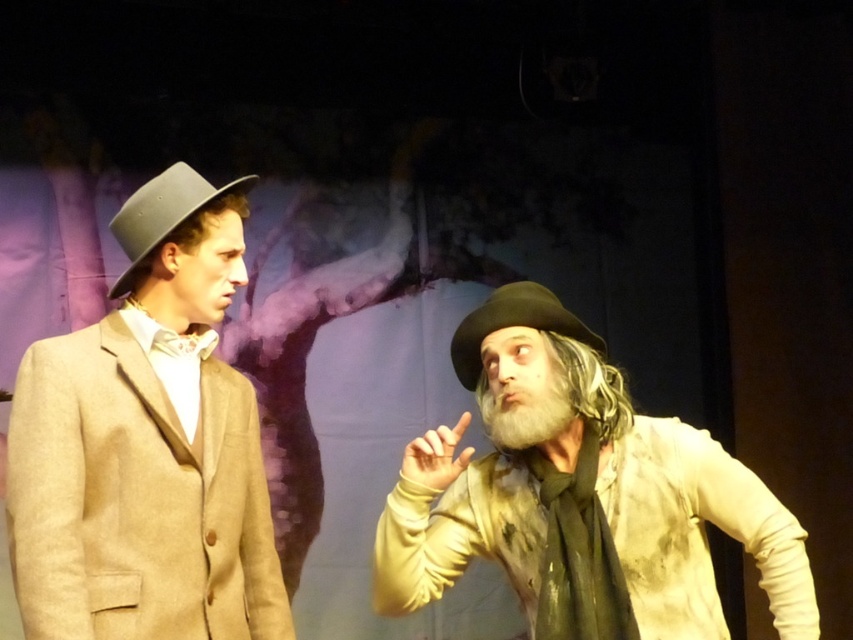
You are an assistant helping to stage a play. You need to ensure that the matte brown suit at left and the black felt dress hat at center are visible to the audience. Since the stage is narrow, you must determine which object is wider to position them appropriately. Which object has a greater width?

The matte brown suit at left has a greater width than the black felt dress hat at center according to the description.

You are directing a play and need to position two actors on stage. The first actor must stand at point [389,554] and the second at point [189,195]. From the audience perspective, which actor will appear closer to the front of the stage?

The actor at point [389,554] will appear closer to the front of the stage because point [389,554] is in front of point [189,195] according to the stage coordinates.

You are a costume designer preparing for a play. You need to ensure that the dirty beige shirt at right and the matte gray dress hat at left fit within the stage backdrop. Given that the backdrop has a maximum width allowance of 1.2 meters, can both items fit side by side without exceeding this limit?

The dirty beige shirt at right is wider than the matte gray dress hat at left. However, without knowing their exact widths or combined total, it is impossible to determine if they fit within the 1.2 meter limit. Additional measurements are needed.